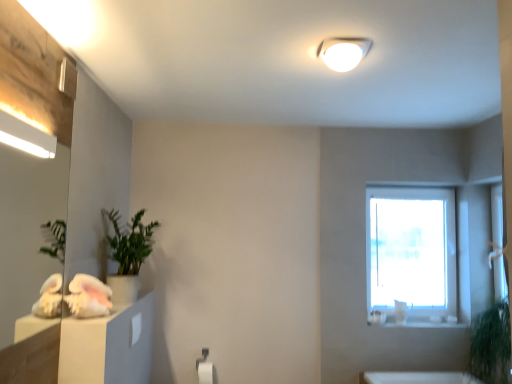
Locate an element on the screen. The image size is (512, 384). matte white drawer at lower left is located at coordinates (135, 328).

Locate an element on the screen. This screenshot has height=384, width=512. green leafy plant at lower right is located at coordinates (490, 344).

The image size is (512, 384). In order to click on white matte toilet paper at lower center in this screenshot , I will do `click(205, 372)`.

In the scene shown: From the image's perspective, is white matte toilet paper at lower center located beneath green matte plant at left?

Yes, from the image's perspective, white matte toilet paper at lower center is beneath green matte plant at left.

Is white matte toilet paper at lower center bigger than green matte plant at left?

No.

Is white matte toilet paper at lower center directly adjacent to green matte plant at left?

→ white matte toilet paper at lower center is not next to green matte plant at left, and they're not touching.

From a real-world perspective, which is physically above, white matte toilet paper at lower center or green matte plant at left?

green matte plant at left, from a real-world perspective.

Visually, is matte wooden mirror at left positioned to the left or to the right of white matte toilet paper at lower center?

Clearly, matte wooden mirror at left is on the left of white matte toilet paper at lower center in the image.

From the picture: Considering the sizes of objects matte wooden mirror at left and white matte toilet paper at lower center in the image provided, who is taller, matte wooden mirror at left or white matte toilet paper at lower center?

matte wooden mirror at left is taller.

Is matte wooden mirror at left completely or partially outside of white matte toilet paper at lower center?

Indeed, matte wooden mirror at left is completely outside white matte toilet paper at lower center.

From a real-world perspective, who is located higher, matte wooden mirror at left or white matte toilet paper at lower center?

From a 3D spatial view, matte wooden mirror at left is above.

Is green leafy plant at lower right facing towards matte wooden mirror at left?

Yes.

Considering the points (490, 338) and (17, 41), which point is behind, point (490, 338) or point (17, 41)?

The point (490, 338) is behind.

Is green leafy plant at lower right next to white matte toilet paper at lower center and touching it?

No, green leafy plant at lower right is not touching white matte toilet paper at lower center.

Who is shorter, green leafy plant at lower right or white matte toilet paper at lower center?

With less height is white matte toilet paper at lower center.

Is green leafy plant at lower right wider or thinner than white matte toilet paper at lower center?

Clearly, green leafy plant at lower right has more width compared to white matte toilet paper at lower center.

Which object is thinner, white matte toilet paper at lower center or white glossy light fixture at upper center?

With smaller width is white matte toilet paper at lower center.

Choose the correct answer: Is white matte toilet paper at lower center inside white glossy light fixture at upper center or outside it?

white matte toilet paper at lower center exists outside the volume of white glossy light fixture at upper center.

Between white matte toilet paper at lower center and white glossy light fixture at upper center, which one has more height?

Standing taller between the two is white matte toilet paper at lower center.

The width and height of the screenshot is (512, 384). I want to click on light fixture above the white matte toilet paper at lower center (from the image's perspective), so click(x=343, y=52).

Does matte wooden mirror at left have a smaller size compared to green leafy plant at lower right?

Correct, matte wooden mirror at left occupies less space than green leafy plant at lower right.

From a real-world perspective, relative to green leafy plant at lower right, is matte wooden mirror at left vertically above or below?

In terms of real-world spatial position, matte wooden mirror at left is above green leafy plant at lower right.

Is matte wooden mirror at left looking in the opposite direction of green leafy plant at lower right?

No, matte wooden mirror at left's orientation is not away from green leafy plant at lower right.

Is matte wooden mirror at left further to the viewer compared to green leafy plant at lower right?

No.

Based on their sizes in the image, would you say matte wooden mirror at left is bigger or smaller than green matte plant at left?

Clearly, matte wooden mirror at left is smaller in size than green matte plant at left.

Is matte wooden mirror at left located outside green matte plant at left?

matte wooden mirror at left is positioned outside green matte plant at left.

Is matte wooden mirror at left in front of or behind green matte plant at left in the image?

matte wooden mirror at left is in front of green matte plant at left.

Between matte wooden mirror at left and green matte plant at left, which one has less height?

green matte plant at left is shorter.

At what (x,y) coordinates should I click in order to perform the action: click on toilet paper on the right side of green matte plant at left. Please return your answer as a coordinate pair (x, y). Looking at the image, I should click on (205, 372).

In the image, there is a matte wooden mirror at left. At what (x,y) coordinates should I click in order to perform the action: click on toilet paper below it (from a real-world perspective). Please return your answer as a coordinate pair (x, y). The height and width of the screenshot is (384, 512). Looking at the image, I should click on (205, 372).

From the image, which object appears to be farther from green leafy plant at lower right, white glossy light fixture at upper center or green matte plant at left?

green matte plant at left is further to green leafy plant at lower right.

Based on the photo, from the image, which object appears to be farther from white glossy light fixture at upper center, matte wooden mirror at left or white matte toilet paper at lower center?

The object further to white glossy light fixture at upper center is white matte toilet paper at lower center.

Considering their positions, is green leafy plant at lower right positioned closer to white glossy light fixture at upper center than matte wooden mirror at left?

green leafy plant at lower right is positioned closer to the anchor white glossy light fixture at upper center.

Considering their positions, is green matte plant at left positioned closer to white glossy light fixture at upper center than white matte toilet paper at lower center?

The object closer to white glossy light fixture at upper center is green matte plant at left.

Which object lies further to the anchor point matte white drawer at lower left, green matte plant at left or matte wooden mirror at left?

Based on the image, matte wooden mirror at left appears to be further to matte white drawer at lower left.

Looking at the image, which one is located further to matte white drawer at lower left, matte wooden mirror at left or green matte plant at left?

matte wooden mirror at left is further to matte white drawer at lower left.

Estimate the real-world distances between objects in this image. Which object is closer to matte wooden mirror at left, green leafy plant at lower right or white matte toilet paper at lower center?

Based on the image, white matte toilet paper at lower center appears to be nearer to matte wooden mirror at left.

From the image, which object appears to be nearer to white matte toilet paper at lower center, matte white drawer at lower left or green leafy plant at lower right?

Based on the image, matte white drawer at lower left appears to be nearer to white matte toilet paper at lower center.

At what (x,y) coordinates should I click in order to perform the action: click on houseplant between white glossy light fixture at upper center and white matte toilet paper at lower center in the up-down direction. Please return your answer as a coordinate pair (x, y). The height and width of the screenshot is (384, 512). Looking at the image, I should click on (128, 254).

At what (x,y) coordinates should I click in order to perform the action: click on plant that lies between white glossy light fixture at upper center and white matte toilet paper at lower center from top to bottom. Please return your answer as a coordinate pair (x, y). Looking at the image, I should click on (490, 344).

You are a GUI agent. You are given a task and a screenshot of the screen. Output one action in this format:
    pyautogui.click(x=<x>, y=<y>)
    Task: Click on the houseplant between matte wooden mirror at left and white matte toilet paper at lower center from front to back
    The image size is (512, 384).
    Given the screenshot: What is the action you would take?
    pyautogui.click(x=128, y=254)

Image resolution: width=512 pixels, height=384 pixels. Find the location of `houseplant between matte wooden mirror at left and matte white drawer at lower left from front to back`. houseplant between matte wooden mirror at left and matte white drawer at lower left from front to back is located at coordinates (128, 254).